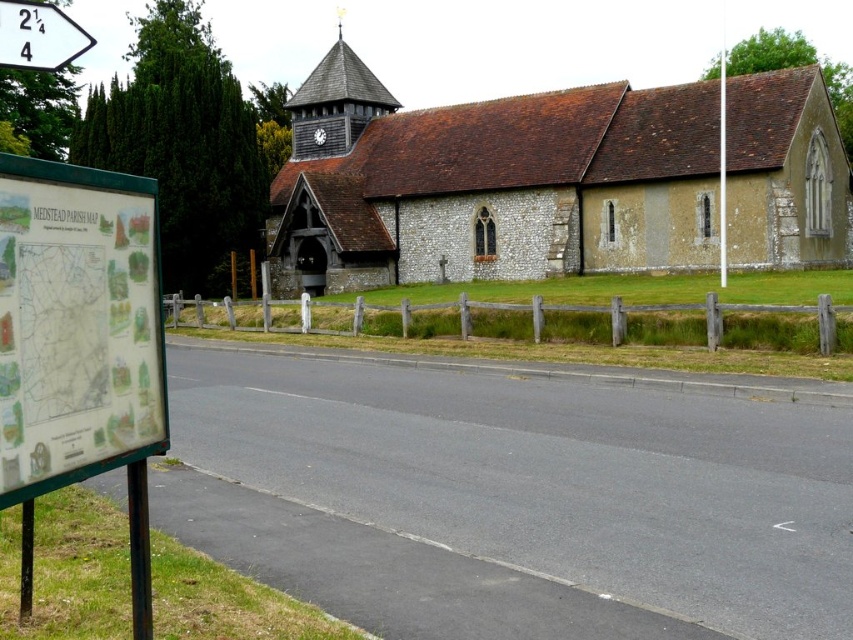
Is point (804, 83) in front of point (125, 294)?

No, it is not.

This screenshot has height=640, width=853. Identify the location of brown stone church at center. (555, 180).

Which of these two, brown stone church at center or wooden shingles spire at upper center, stands taller?

With more height is brown stone church at center.

Is brown stone church at center closer to camera compared to wooden shingles spire at upper center?

That is True.

Who is more distant from viewer, (387, 113) or (306, 115)?

Positioned behind is point (387, 113).

At what (x,y) coordinates should I click in order to perform the action: click on brown stone church at center. Please return your answer as a coordinate pair (x, y). This screenshot has width=853, height=640. Looking at the image, I should click on (555, 180).

Which is in front, point (136, 438) or point (54, 54)?

Positioned in front is point (136, 438).

What do you see at coordinates (76, 324) in the screenshot? I see `transparent plastic map at lower left` at bounding box center [76, 324].

Where is `transparent plastic map at lower left`? The height and width of the screenshot is (640, 853). transparent plastic map at lower left is located at coordinates (76, 324).